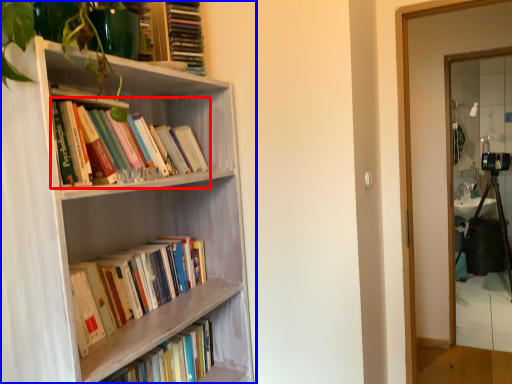
Question: Which of the following is the closest to the observer, book (highlighted by a red box) or bookcase (highlighted by a blue box)?

Choices:
 (A) book
 (B) bookcase

Answer: (B)